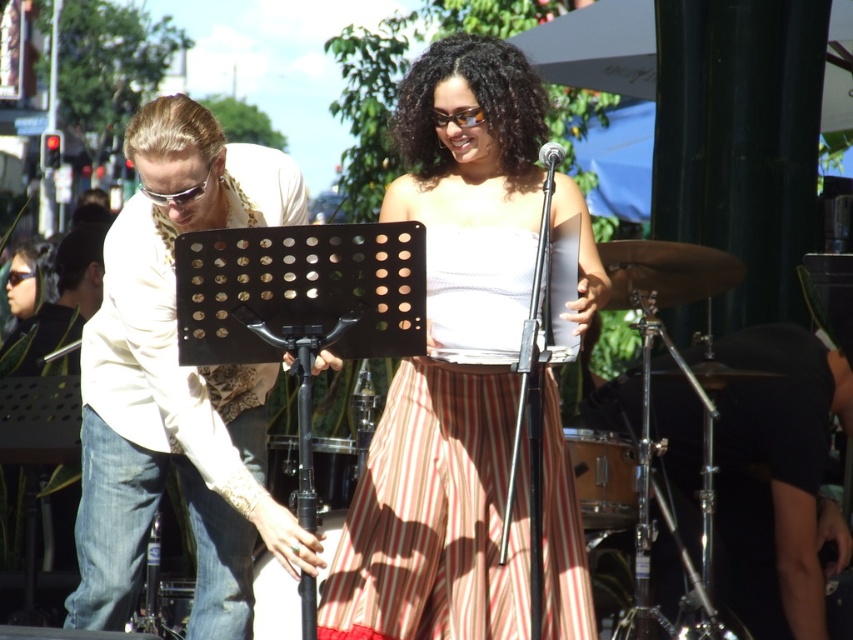
You are an event photographer at the performance. You need to capture a photo that includes both the white satin dress at center and the white lace shirt at left. Based on their positions, which one will appear lower in the photo?

The white satin dress at center appears lower in the photo because it is positioned under the white lace shirt at left.

You are a stagehand who needs to place a new microphone stand between the white lace shirt at left and the wooden drum at center. Based on their sizes, which object should the microphone stand be closer to?

The white lace shirt at left is bigger than the wooden drum at center, so the microphone stand should be placed closer to the wooden drum at center to maintain balance between the two objects.

In the scene shown: You are standing at the point with coordinates point (142, 307) and want to walk to the point with coordinates point (485, 429). Which direction should you move in?

You should move backward because point (485, 429) is behind point (142, 307).